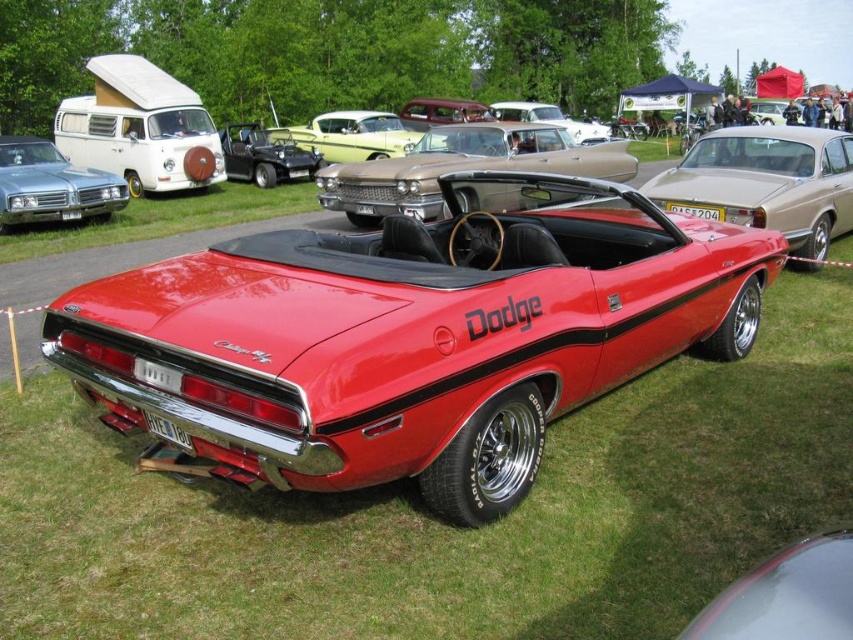
Question: Based on their relative distances, which object is nearer to the metallic yellow car at center?

Choices:
 (A) shiny red dodge convertible at center
 (B) metallic black convertible at center
 (C) shiny red dodge challenger at center
 (D) shiny silver sedan at left

Answer: (B)

Question: In this image, where is shiny red dodge challenger at center located relative to shiny red dodge convertible at center?

Choices:
 (A) left
 (B) right

Answer: (A)

Question: Is shiny red dodge challenger at center closer to the viewer compared to metallic yellow car at center?

Choices:
 (A) yes
 (B) no

Answer: (A)

Question: Which point is closer to the camera taking this photo?

Choices:
 (A) (573, 129)
 (B) (395, 144)
 (C) (299, 154)

Answer: (B)

Question: Among these points, which one is nearest to the camera?

Choices:
 (A) (113, 189)
 (B) (405, 292)
 (C) (233, 161)
 (D) (578, 131)

Answer: (B)

Question: Can you confirm if shiny red dodge challenger at center is bigger than metallic black convertible at center?

Choices:
 (A) yes
 (B) no

Answer: (A)